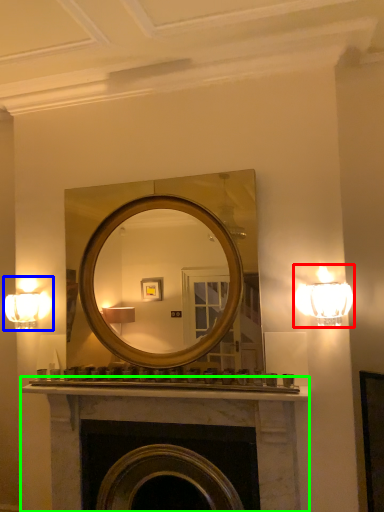
Question: Which is nearer to the lamp (highlighted by a red box)? fixture (highlighted by a blue box) or fireplace (highlighted by a green box).

Choices:
 (A) fixture
 (B) fireplace

Answer: (B)